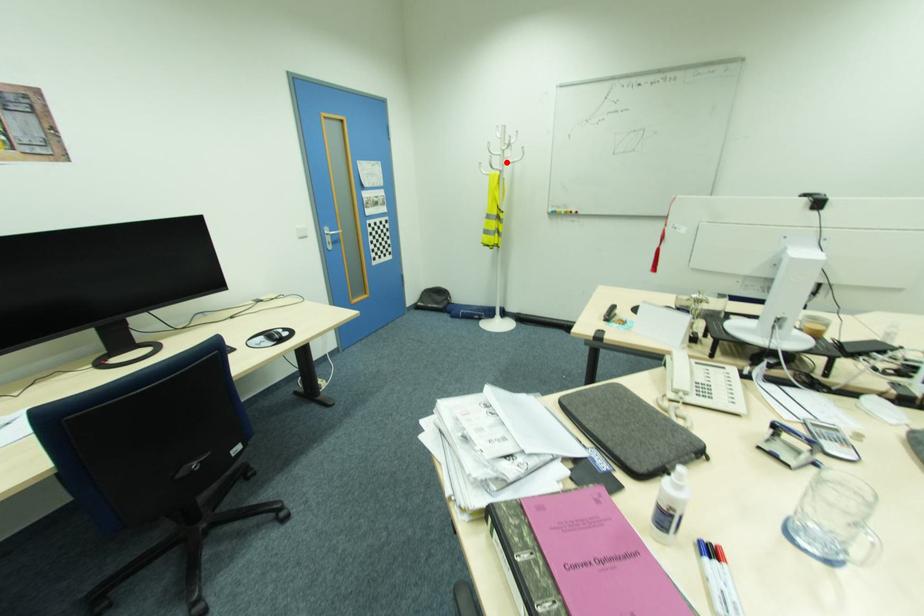
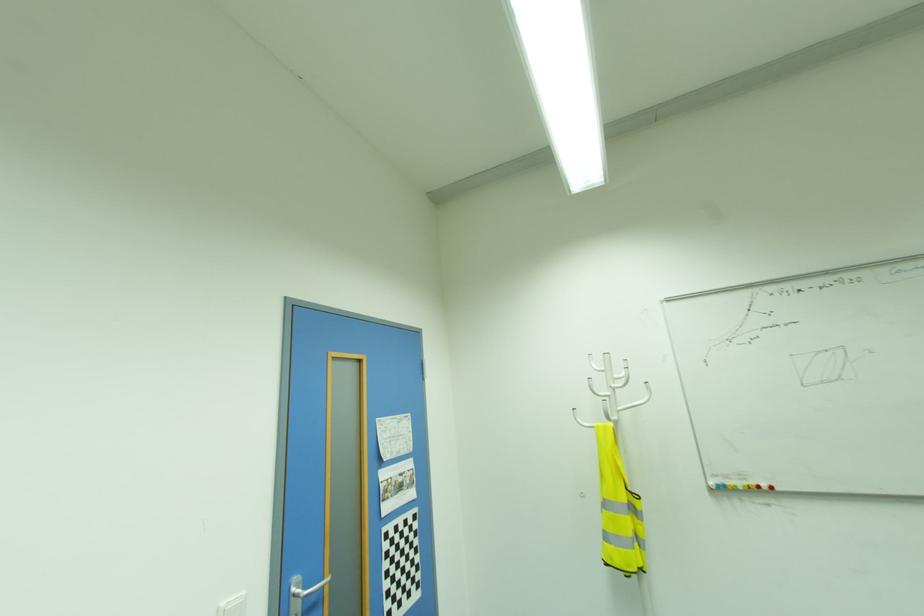
Question: I am providing you with two images of the same scene from different viewpoints. Given a red point in image1, look at the same physical point in image2. Is it:

Choices:
 (A) Closer to the viewpoint
 (B) Farther from the viewpoint

Answer: (B)